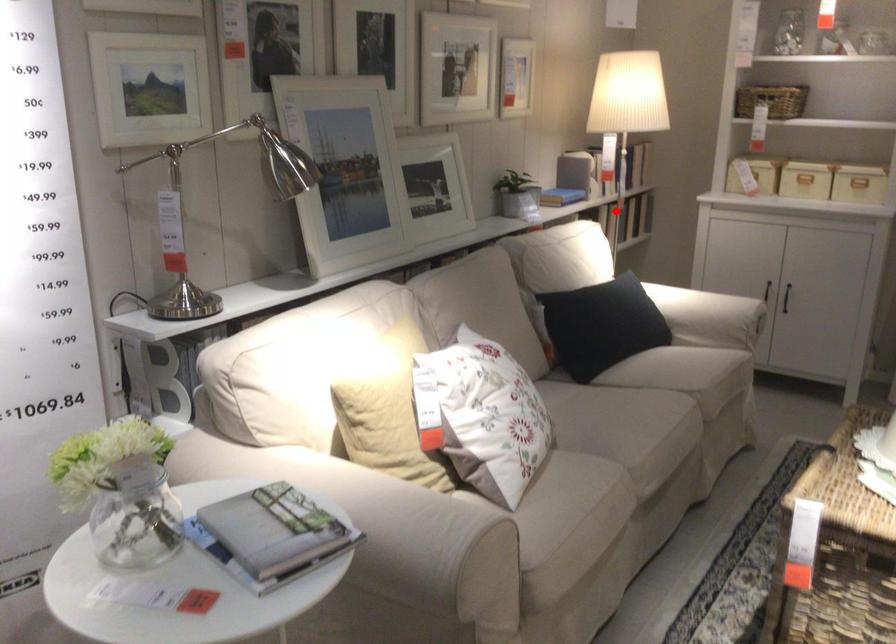
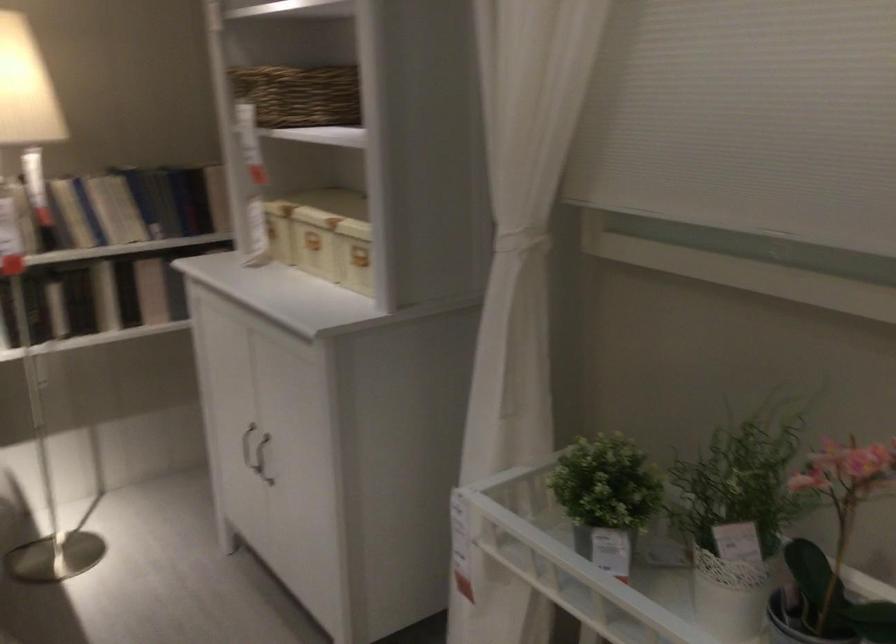
Locate, in the second image, the point that corresponds to the highlighted location in the first image.

(105, 296)